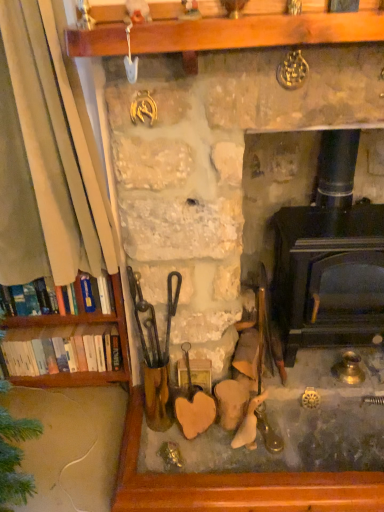
Find the location of `black cast iron wood burning stove at center`. black cast iron wood burning stove at center is located at coordinates (328, 257).

Describe the element at coordinates (61, 350) in the screenshot. The width and height of the screenshot is (384, 512). I see `white paperbacks at left, which ranks as the second book in top-to-bottom order` at that location.

This screenshot has height=512, width=384. In order to click on stone fireplace at center in this screenshot , I will do `click(216, 173)`.

The height and width of the screenshot is (512, 384). In order to click on black cast iron wood burning stove at center in this screenshot , I will do `click(328, 257)`.

In terms of width, does hardcover books at left, the second book ordered from the bottom, look wider or thinner when compared to stone fireplace at center?

Considering their sizes, hardcover books at left, the second book ordered from the bottom, looks slimmer than stone fireplace at center.

From the image's perspective, is hardcover books at left, the second book ordered from the bottom, located above stone fireplace at center?

Incorrect, from the image's perspective, hardcover books at left, the second book ordered from the bottom, is lower than stone fireplace at center.

Does point (10, 305) come closer to viewer compared to point (129, 309)?

No, it is behind (129, 309).

From a real-world perspective, is hardcover books at left, arranged as the 1th book when viewed from the front, over stone fireplace at center?

No, from a real-world perspective, hardcover books at left, arranged as the 1th book when viewed from the front, is not over stone fireplace at center

In terms of size, does black cast iron wood burning stove at center appear bigger or smaller than stone fireplace at center?

In the image, black cast iron wood burning stove at center appears to be smaller than stone fireplace at center.

From the image's perspective, which object appears higher, black cast iron wood burning stove at center or stone fireplace at center?

stone fireplace at center.

Looking at this image, which object is further away from the camera, black cast iron wood burning stove at center or stone fireplace at center?

black cast iron wood burning stove at center is further away from the camera.

Is black cast iron wood burning stove at center at the right side of stone fireplace at center?

Yes, black cast iron wood burning stove at center is to the right of stone fireplace at center.

Does white paperbacks at left, positioned as the second book in front-to-back order, have a smaller size compared to black cast iron wood burning stove at center?

Correct, white paperbacks at left, positioned as the second book in front-to-back order, occupies less space than black cast iron wood burning stove at center.

In the scene shown: What's the angular difference between white paperbacks at left, which ranks as the second book in top-to-bottom order, and black cast iron wood burning stove at center's facing directions?

2.36 degrees.

Considering the relative sizes of white paperbacks at left, which is the first book from back to front, and black cast iron wood burning stove at center in the image provided, is white paperbacks at left, which is the first book from back to front, wider than black cast iron wood burning stove at center?

Incorrect, the width of white paperbacks at left, which is the first book from back to front, does not surpass that of black cast iron wood burning stove at center.

In the image, is white paperbacks at left, which ranks as the second book in top-to-bottom order, positioned in front of or behind black cast iron wood burning stove at center?

white paperbacks at left, which ranks as the second book in top-to-bottom order, is behind black cast iron wood burning stove at center.

Based on their sizes in the image, would you say stone fireplace at center is bigger or smaller than black cast iron wood burning stove at center?

In the image, stone fireplace at center appears to be larger than black cast iron wood burning stove at center.

Does stone fireplace at center have a lesser height compared to black cast iron wood burning stove at center?

Incorrect, the height of stone fireplace at center does not fall short of that of black cast iron wood burning stove at center.

What's the angular difference between stone fireplace at center and black cast iron wood burning stove at center's facing directions?

stone fireplace at center and black cast iron wood burning stove at center are facing 0.916 degrees away from each other.

From a real-world perspective, is stone fireplace at center physically above black cast iron wood burning stove at center?

Yes, from a real-world perspective, stone fireplace at center is over black cast iron wood burning stove at center

How far apart are black cast iron wood burning stove at center and hardcover books at left, which is the 2th book from back to front?

32.79 inches.

From the picture: Do you think black cast iron wood burning stove at center is within hardcover books at left, placed as the 1th book when sorted from top to bottom, or outside of it?

black cast iron wood burning stove at center is outside hardcover books at left, placed as the 1th book when sorted from top to bottom.

From the picture: Which of these two, black cast iron wood burning stove at center or hardcover books at left, which is the 2th book from back to front, is wider?

black cast iron wood burning stove at center.

In the scene shown: From the image's perspective, which one is positioned lower, hardcover books at left, which is the 2th book from back to front, or black cast iron wood burning stove at center?

hardcover books at left, which is the 2th book from back to front.

At what (x,y) coordinates should I click in order to perform the action: click on book above the black cast iron wood burning stove at center (from a real-world perspective). Please return your answer as a coordinate pair (x, y). Image resolution: width=384 pixels, height=512 pixels. Looking at the image, I should click on (90, 295).

From a real-world perspective, which object rests below the other?

black cast iron wood burning stove at center.

Is black cast iron wood burning stove at center positioned with its back to white paperbacks at left, positioned as the second book in front-to-back order?

black cast iron wood burning stove at center is not turned away from white paperbacks at left, positioned as the second book in front-to-back order.

Can you confirm if black cast iron wood burning stove at center is shorter than white paperbacks at left, which ranks as the second book in top-to-bottom order?

Incorrect, the height of black cast iron wood burning stove at center does not fall short of that of white paperbacks at left, which ranks as the second book in top-to-bottom order.

How distant is black cast iron wood burning stove at center from white paperbacks at left, the 1th book from the bottom?

The distance of black cast iron wood burning stove at center from white paperbacks at left, the 1th book from the bottom, is 34.90 inches.

Can you confirm if black cast iron wood burning stove at center is positioned to the left of white paperbacks at left, which ranks as the second book in top-to-bottom order?

Incorrect, black cast iron wood burning stove at center is not on the left side of white paperbacks at left, which ranks as the second book in top-to-bottom order.

Locate an element on the screen. The image size is (384, 512). the 1st book behind when counting from the stone fireplace at center is located at coordinates (90, 295).

The image size is (384, 512). What are the coordinates of `fireplace that appears above the black cast iron wood burning stove at center (from a real-world perspective)` in the screenshot? It's located at (216, 173).

Which object lies nearer to the anchor point stone fireplace at center, white paperbacks at left, the 1th book from the bottom, or black cast iron wood burning stove at center?

black cast iron wood burning stove at center lies closer to stone fireplace at center than the other object.

Based on their spatial positions, is black cast iron wood burning stove at center or hardcover books at left, which is the 2th book from back to front, further from stone fireplace at center?

Based on the image, hardcover books at left, which is the 2th book from back to front, appears to be further to stone fireplace at center.

Based on their spatial positions, is black cast iron wood burning stove at center or white paperbacks at left, which ranks as the second book in top-to-bottom order, further from stone fireplace at center?

white paperbacks at left, which ranks as the second book in top-to-bottom order, lies further to stone fireplace at center than the other object.

Looking at the image, which one is located closer to hardcover books at left, which is the 2th book from back to front, black cast iron wood burning stove at center or stone fireplace at center?

stone fireplace at center is positioned closer to the anchor hardcover books at left, which is the 2th book from back to front.

When comparing their distances from black cast iron wood burning stove at center, does white paperbacks at left, which ranks as the second book in top-to-bottom order, or stone fireplace at center seem further?

The object further to black cast iron wood burning stove at center is white paperbacks at left, which ranks as the second book in top-to-bottom order.

Which object lies further to the anchor point stone fireplace at center, white paperbacks at left, which ranks as the second book in top-to-bottom order, or hardcover books at left, arranged as the 1th book when viewed from the front?

Among the two, white paperbacks at left, which ranks as the second book in top-to-bottom order, is located further to stone fireplace at center.

When comparing their distances from stone fireplace at center, does hardcover books at left, placed as the 1th book when sorted from top to bottom, or white paperbacks at left, which is the first book from back to front, seem closer?

hardcover books at left, placed as the 1th book when sorted from top to bottom, lies closer to stone fireplace at center than the other object.

Considering their positions, is stone fireplace at center positioned further to hardcover books at left, the second book ordered from the bottom, than black cast iron wood burning stove at center?

black cast iron wood burning stove at center lies further to hardcover books at left, the second book ordered from the bottom, than the other object.

Identify the location of fireplace between hardcover books at left, placed as the 1th book when sorted from top to bottom, and black cast iron wood burning stove at center. (216, 173).

Locate an element on the screen. The height and width of the screenshot is (512, 384). book located between hardcover books at left, arranged as the 1th book when viewed from the front, and black cast iron wood burning stove at center in the left-right direction is located at coordinates (x=61, y=350).

Where is `fireplace situated between white paperbacks at left, which is the first book from back to front, and black cast iron wood burning stove at center from left to right`? The image size is (384, 512). fireplace situated between white paperbacks at left, which is the first book from back to front, and black cast iron wood burning stove at center from left to right is located at coordinates (216, 173).

Locate an element on the screen. book located between hardcover books at left, arranged as the 1th book when viewed from the front, and stone fireplace at center in the left-right direction is located at coordinates (61, 350).